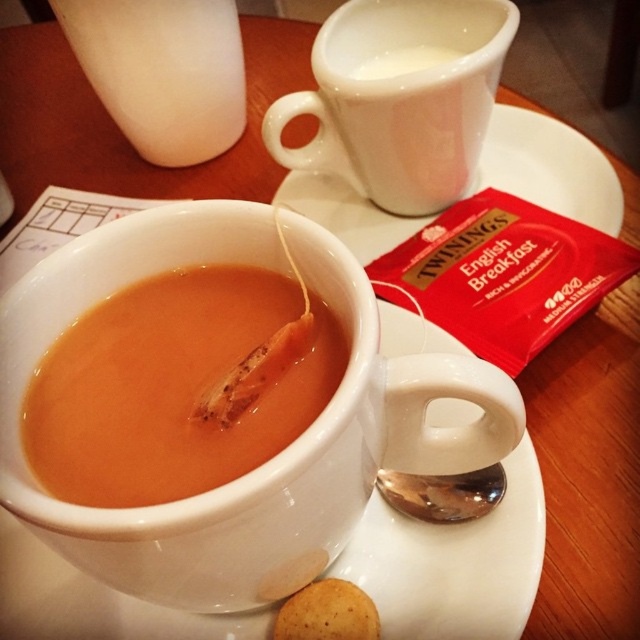
Question: Which object is closer to the camera taking this photo?

Choices:
 (A) golden brown cookie at lower center
 (B) white glossy mug at upper center

Answer: (A)

Question: Is matte orange soup at center to the right of white glossy mug at upper center from the viewer's perspective?

Choices:
 (A) no
 (B) yes

Answer: (A)

Question: Which point is farther to the camera?

Choices:
 (A) white ceramic saucer at upper center
 (B) matte orange soup at center
 (C) white glossy mug at upper center
 (D) white glossy cup at upper center

Answer: (D)

Question: Does silver/metallic spoon at lower center have a lesser width compared to white glossy cup at upper center?

Choices:
 (A) no
 (B) yes

Answer: (B)

Question: Which object is farther from the camera taking this photo?

Choices:
 (A) white glossy cup at upper center
 (B) white ceramic saucer at upper center
 (C) matte white mug at center

Answer: (A)

Question: Can you confirm if matte orange soup at center is thinner than white matte milk container at upper left?

Choices:
 (A) no
 (B) yes

Answer: (B)